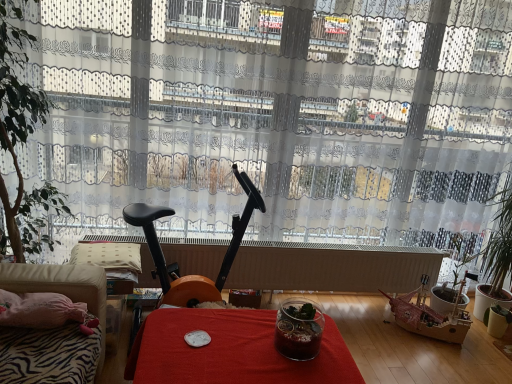
At what (x,y) coordinates should I click in order to perform the action: click on free point above red fabric table at center (from a real-world perspective). Please return your answer as a coordinate pair (x, y). Looking at the image, I should click on (247, 346).